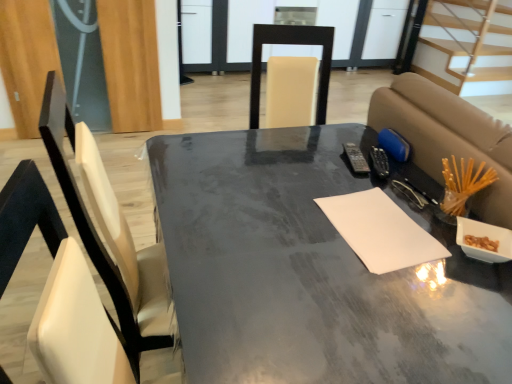
At what (x,y) coordinates should I click in order to perform the action: click on unoccupied space behind white paper at center. Please return your answer as a coordinate pair (x, y). The height and width of the screenshot is (384, 512). Looking at the image, I should click on point(358,183).